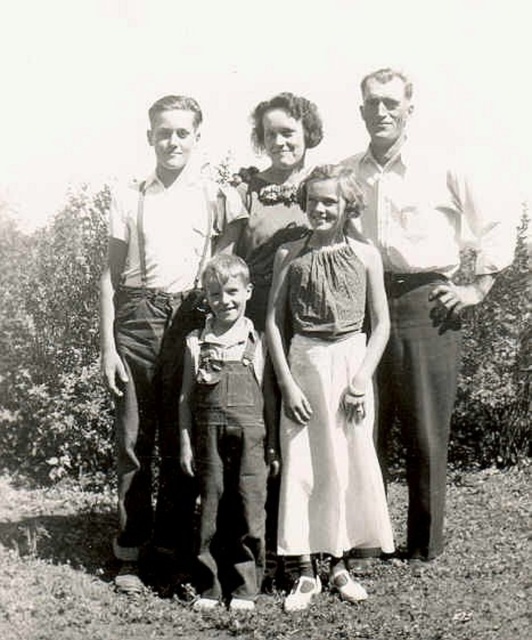
You are a photographer reviewing this black and white photo. You notice two white shirts in the image. The first is the matte white shirt at upper left and the second is the smooth white shirt at center. Based on their positions, which shirt appears higher up in the frame?

The matte white shirt at upper left appears higher up in the frame than the smooth white shirt at center because it is located above it.

Based on the scene description, which clothing item is shorter in height between the textured white dress at center and the white cotton shirt at left?

The textured white dress at center has a lesser height compared to the white cotton shirt at left, so the textured white dress at center is shorter in height.

In the family photo, there are two white shirts visible. The first is the matte white shirt at upper left, and the second is the smooth white shirt at center. From the perspective of someone looking at the photo, which shirt is positioned to the right of the other?

The matte white shirt at upper left is to the right of the smooth white shirt at center, meaning the matte white shirt at upper left is positioned further to the right compared to the smooth white shirt at center.